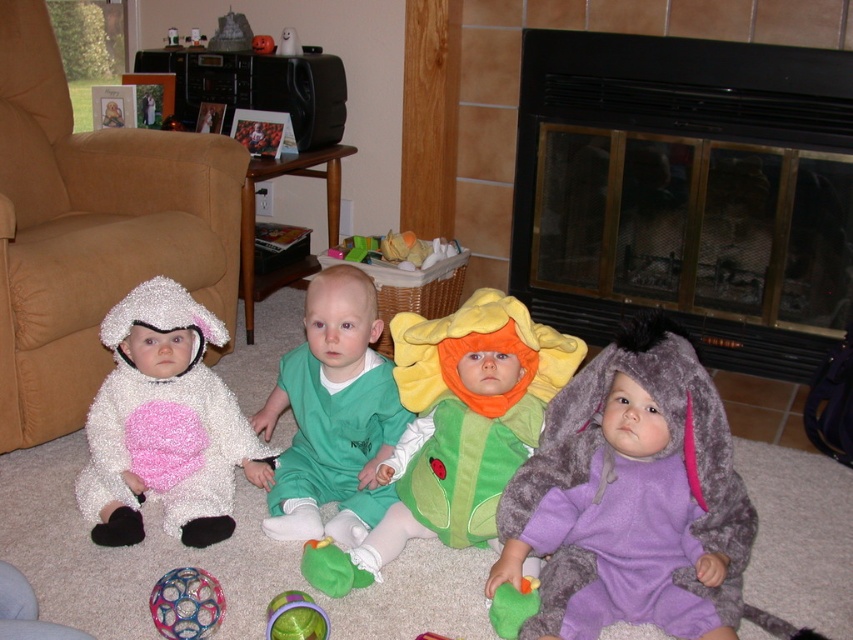
Does green fabric flower at center have a greater height compared to green fabric onesie at center?

Yes.

Locate an element on the screen. green fabric flower at center is located at coordinates (457, 426).

Does black glass fireplace at center have a smaller size compared to translucent plastic ball at center?

Incorrect, black glass fireplace at center is not smaller in size than translucent plastic ball at center.

Image resolution: width=853 pixels, height=640 pixels. What are the coordinates of `black glass fireplace at center` in the screenshot? It's located at (688, 193).

Who is higher up, green fabric flower at center or fluffy white costume at left?

Positioned higher is fluffy white costume at left.

Who is more distant from viewer, [523,442] or [223,456]?

The point [223,456] is behind.

Identify the location of green fabric flower at center. This screenshot has height=640, width=853. (457, 426).